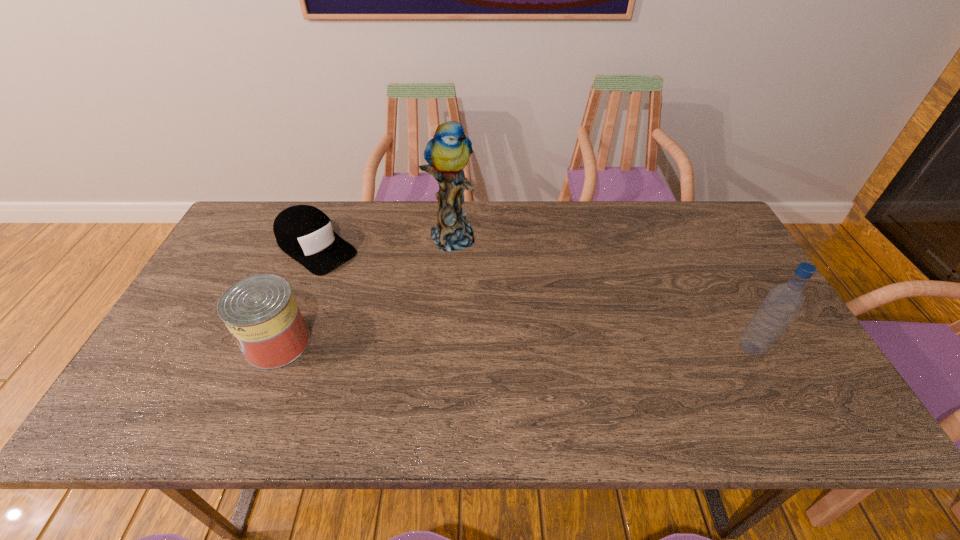
Locate an element on the screen. This screenshot has height=540, width=960. vacant space at the far edge of the desktop is located at coordinates (466, 209).

You are a GUI agent. You are given a task and a screenshot of the screen. Output one action in this format:
    pyautogui.click(x=<x>, y=<y>)
    Task: Click on the vacant position at the near edge of the desktop
    The image size is (960, 540).
    Given the screenshot: What is the action you would take?
    (710, 367)

Locate an element on the screen. vacant space at the left edge of the desktop is located at coordinates (169, 347).

Locate an element on the screen. The width and height of the screenshot is (960, 540). vacant space at the right edge is located at coordinates tap(725, 296).

In the image, there is a desktop. Where is `vacant space at the far left corner`? This screenshot has height=540, width=960. vacant space at the far left corner is located at coordinates (245, 216).

Locate an element on the screen. unoccupied area between the can and the rightmost object is located at coordinates (515, 346).

The width and height of the screenshot is (960, 540). Identify the location of empty space between the third tallest object and the third shortest object. (515, 346).

Find the location of a particular element. free spot between the cap and the second shortest object is located at coordinates (297, 295).

This screenshot has width=960, height=540. What are the coordinates of `unoccupied position between the third object from left to right and the third shortest object` in the screenshot? It's located at (601, 291).

Image resolution: width=960 pixels, height=540 pixels. Find the location of `vacant space in between the third tallest object and the rightmost object`. vacant space in between the third tallest object and the rightmost object is located at coordinates (515, 346).